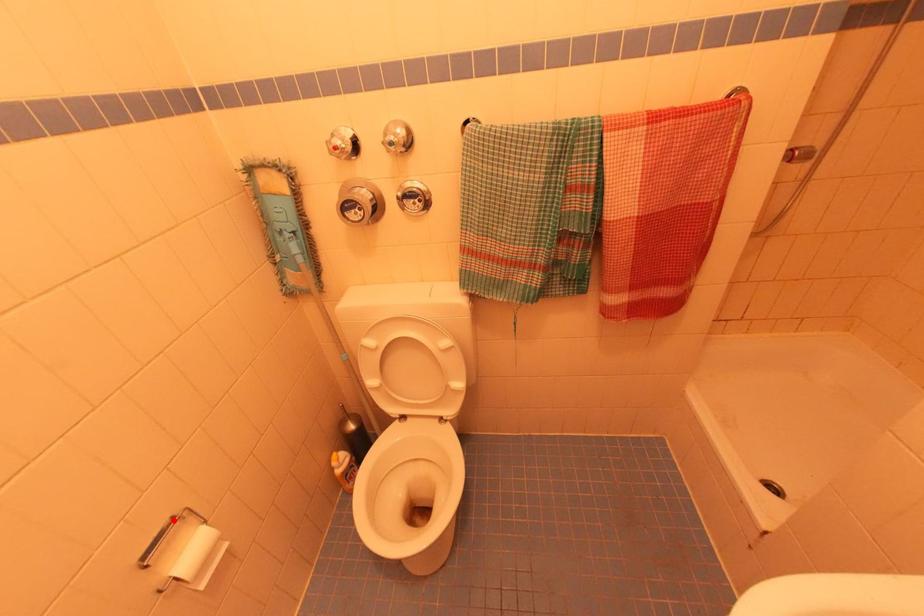
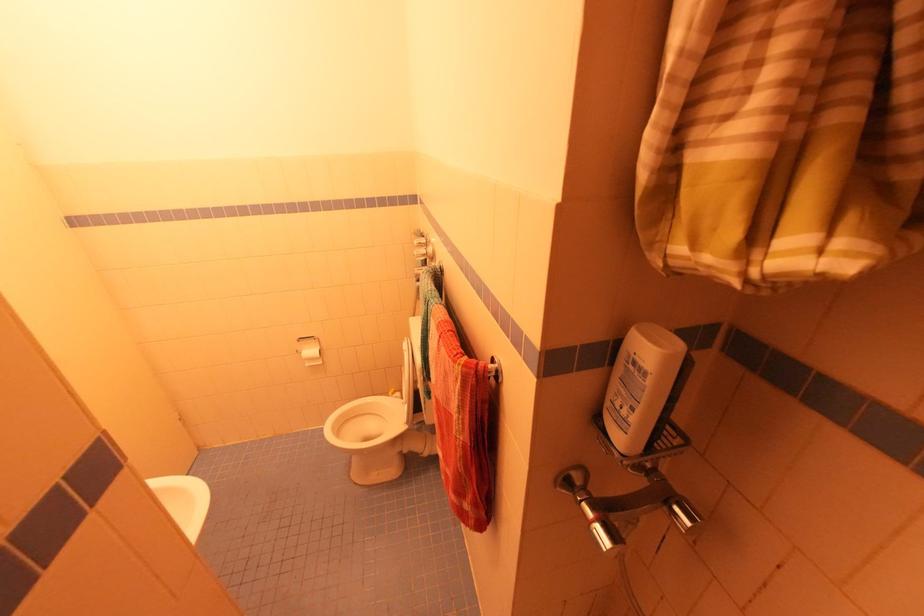
Find the pixel in the second image that matches the highlighted location in the first image.

(314, 338)